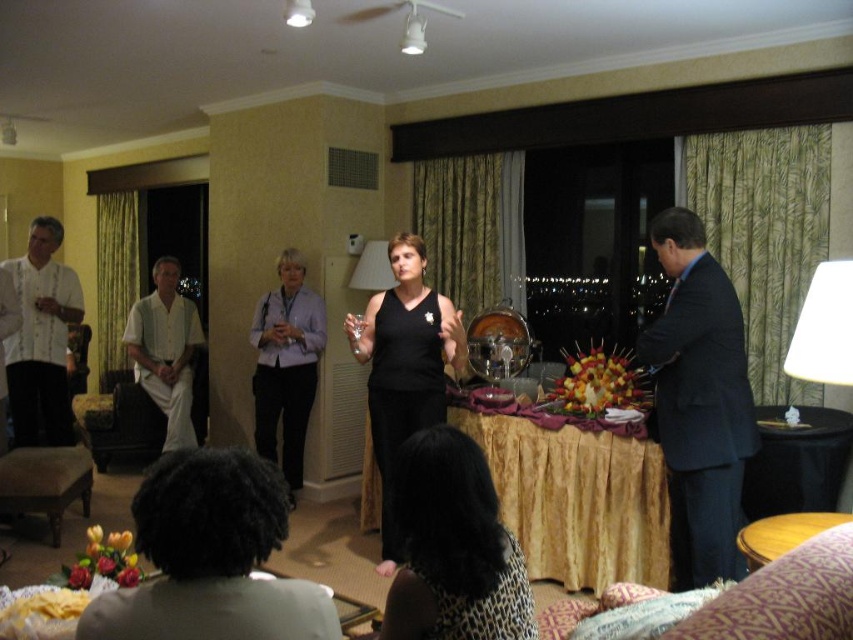
You are a photographer trying to capture a candid shot of the dark gray shirt at lower left and the wooden table at lower right. Since you want to ensure both are in focus, which object should you position your camera closer to?

The dark gray shirt at lower left is in front of the wooden table at lower right, so you should position your camera closer to the dark gray shirt at lower left to ensure both are in focus.

You are standing in the center of the room and want to greet the person wearing the dark gray shirt at lower left. In which direction should you move to reach them?

The dark gray shirt at lower left is located at point (x=210, y=557), so you should move towards the lower left direction to reach them.